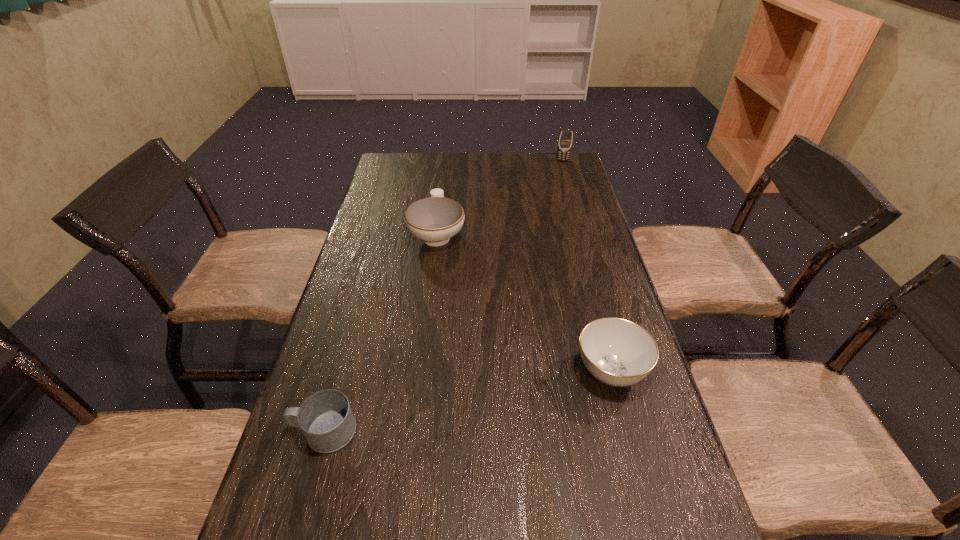
Find the location of `vacant area between the farthest object and the left chinaware`. vacant area between the farthest object and the left chinaware is located at coordinates (500, 197).

Where is `free spot between the right chinaware and the nearest object`? This screenshot has height=540, width=960. free spot between the right chinaware and the nearest object is located at coordinates (468, 401).

At what (x,y) coordinates should I click in order to perform the action: click on unoccupied position between the second farthest object and the right chinaware. Please return your answer as a coordinate pair (x, y). Looking at the image, I should click on (x=524, y=302).

The height and width of the screenshot is (540, 960). Identify the location of blank region between the second object from left to right and the cellular telephone. (500, 197).

This screenshot has height=540, width=960. In order to click on object that is the closest to the nearer chinaware in this screenshot , I will do `click(435, 219)`.

Where is `object that is the third nearest to the tallest object`? object that is the third nearest to the tallest object is located at coordinates (326, 419).

I want to click on free spot that satisfies the following two spatial constraints: 1. on the front face of the cellular telephone; 2. on the side of the mug with the handle, so click(x=642, y=431).

The image size is (960, 540). In order to click on vacant region that satisfies the following two spatial constraints: 1. on the front face of the cellular telephone; 2. on the side of the mug with the handle in this screenshot , I will do `click(642, 431)`.